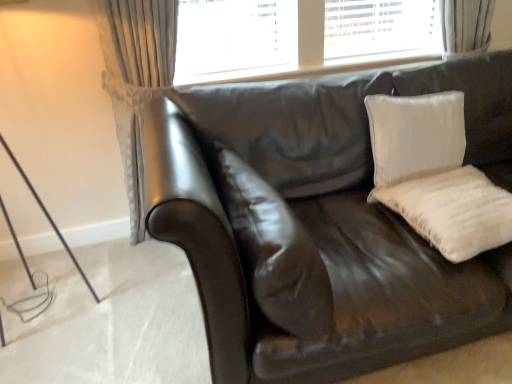
Question: Which direction should I rotate to look at satin brown pillow at center, the 1th pillow from the left?

Choices:
 (A) left
 (B) right

Answer: (B)

Question: Can you confirm if satin brown pillow at center, the 1th pillow from the left, is thinner than shiny brown leather couch at center?

Choices:
 (A) yes
 (B) no

Answer: (A)

Question: Is satin brown pillow at center, which ranks as the third pillow in right-to-left order, not inside shiny brown leather couch at center?

Choices:
 (A) yes
 (B) no

Answer: (B)

Question: From a real-world perspective, is satin brown pillow at center, the 1th pillow from the left, positioned over shiny brown leather couch at center based on gravity?

Choices:
 (A) yes
 (B) no

Answer: (A)

Question: From the image's perspective, is satin brown pillow at center, the 1th pillow from the left, below shiny brown leather couch at center?

Choices:
 (A) no
 (B) yes

Answer: (B)

Question: Considering the relative positions of satin brown pillow at center, which ranks as the third pillow in right-to-left order, and shiny brown leather couch at center in the image provided, is satin brown pillow at center, which ranks as the third pillow in right-to-left order, to the right of shiny brown leather couch at center from the viewer's perspective?

Choices:
 (A) no
 (B) yes

Answer: (A)

Question: From a real-world perspective, is satin brown pillow at center, the 1th pillow from the left, beneath shiny brown leather couch at center?

Choices:
 (A) no
 (B) yes

Answer: (A)

Question: Is satin brown pillow at center, the 1th pillow from the left, oriented towards white textured pillow at upper right, which ranks as the 2th pillow in right-to-left order?

Choices:
 (A) no
 (B) yes

Answer: (B)

Question: Is satin brown pillow at center, the 1th pillow from the left, to the right of white textured pillow at upper right, acting as the 2th pillow starting from the left, from the viewer's perspective?

Choices:
 (A) yes
 (B) no

Answer: (B)

Question: Considering the relative sizes of satin brown pillow at center, which ranks as the third pillow in right-to-left order, and white textured pillow at upper right, which ranks as the 2th pillow in right-to-left order, in the image provided, is satin brown pillow at center, which ranks as the third pillow in right-to-left order, smaller than white textured pillow at upper right, which ranks as the 2th pillow in right-to-left order,?

Choices:
 (A) yes
 (B) no

Answer: (B)

Question: Considering the relative sizes of satin brown pillow at center, which ranks as the third pillow in right-to-left order, and white textured pillow at upper right, acting as the 2th pillow starting from the left, in the image provided, is satin brown pillow at center, which ranks as the third pillow in right-to-left order, shorter than white textured pillow at upper right, acting as the 2th pillow starting from the left,?

Choices:
 (A) no
 (B) yes

Answer: (B)

Question: Can you confirm if satin brown pillow at center, the 1th pillow from the left, is taller than white textured pillow at upper right, which ranks as the 2th pillow in right-to-left order?

Choices:
 (A) no
 (B) yes

Answer: (A)

Question: Can you confirm if satin brown pillow at center, which ranks as the third pillow in right-to-left order, is positioned to the left of white textured pillow at upper right, acting as the 2th pillow starting from the left?

Choices:
 (A) no
 (B) yes

Answer: (B)

Question: Is white textured pillow at upper right, acting as the 2th pillow starting from the left, turned away from shiny brown leather couch at center?

Choices:
 (A) no
 (B) yes

Answer: (B)